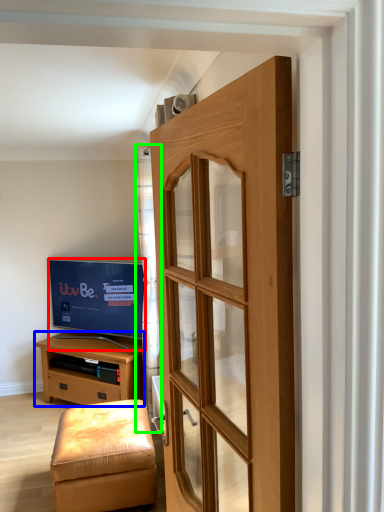
Question: Which is farther away from television (highlighted by a red box)? chest of drawers (highlighted by a blue box) or curtain (highlighted by a green box)?

Choices:
 (A) chest of drawers
 (B) curtain

Answer: (B)